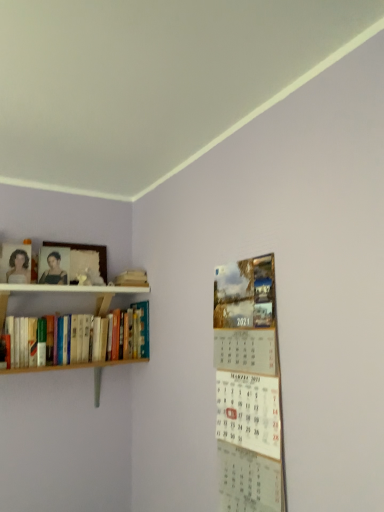
Question: Is matte black portrait at upper left, the second person viewed from the left, at the left side of wooden photo frame at upper left?

Choices:
 (A) no
 (B) yes

Answer: (B)

Question: Is wooden photo frame at upper left completely or partially inside matte black portrait at upper left, which is counted as the first person, starting from the right?

Choices:
 (A) no
 (B) yes

Answer: (A)

Question: From the image's perspective, does matte black portrait at upper left, the second person viewed from the left, appear lower than wooden photo frame at upper left?

Choices:
 (A) yes
 (B) no

Answer: (A)

Question: Is matte black portrait at upper left, the second person viewed from the left, bigger than wooden photo frame at upper left?

Choices:
 (A) no
 (B) yes

Answer: (A)

Question: From the image's perspective, is matte black portrait at upper left, the second person viewed from the left, on top of wooden photo frame at upper left?

Choices:
 (A) no
 (B) yes

Answer: (A)

Question: From the image's perspective, is metallic silver calendar at right positioned above or below wooden photo frame at upper left?

Choices:
 (A) above
 (B) below

Answer: (B)

Question: In the image, is metallic silver calendar at right on the left side or the right side of wooden photo frame at upper left?

Choices:
 (A) right
 (B) left

Answer: (A)

Question: Considering the positions of point (253, 492) and point (74, 247), is point (253, 492) closer or farther from the camera than point (74, 247)?

Choices:
 (A) farther
 (B) closer

Answer: (B)

Question: Considering the positions of metallic silver calendar at right and wooden photo frame at upper left in the image, is metallic silver calendar at right taller or shorter than wooden photo frame at upper left?

Choices:
 (A) short
 (B) tall

Answer: (B)

Question: In terms of size, does wooden photo frame at upper left appear bigger or smaller than wooden books at left?

Choices:
 (A) big
 (B) small

Answer: (B)

Question: Visually, is wooden photo frame at upper left positioned to the left or to the right of wooden books at left?

Choices:
 (A) left
 (B) right

Answer: (A)

Question: From the image's perspective, relative to wooden books at left, is wooden photo frame at upper left above or below?

Choices:
 (A) below
 (B) above

Answer: (B)

Question: Is wooden photo frame at upper left inside the boundaries of wooden books at left, or outside?

Choices:
 (A) inside
 (B) outside

Answer: (B)

Question: Considering their positions, is metallic silver calendar at right located in front of or behind wooden books at left?

Choices:
 (A) front
 (B) behind

Answer: (A)

Question: From the image's perspective, is metallic silver calendar at right above or below wooden books at left?

Choices:
 (A) below
 (B) above

Answer: (A)